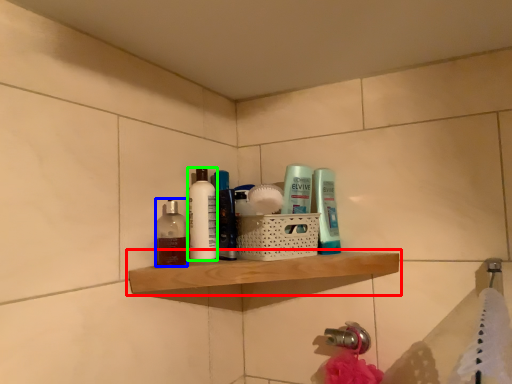
Question: Considering the real-world distances, which object is closest to shelf (highlighted by a red box)? mouthwash (highlighted by a blue box) or toiletry (highlighted by a green box).

Choices:
 (A) mouthwash
 (B) toiletry

Answer: (B)